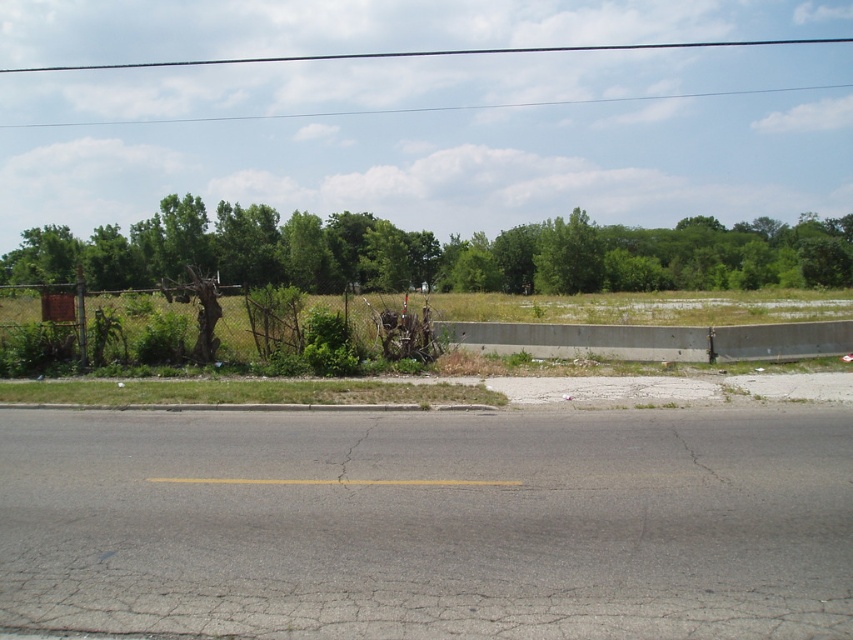
Does green leafy tree at upper center appear on the left side of rusty metal fence at left?

Correct, you'll find green leafy tree at upper center to the left of rusty metal fence at left.

Who is shorter, green leafy tree at upper center or rusty metal fence at left?

Standing shorter between the two is rusty metal fence at left.

Locate an element on the screen. The image size is (853, 640). green leafy tree at upper center is located at coordinates (x=437, y=253).

Image resolution: width=853 pixels, height=640 pixels. I want to click on green leafy tree at upper center, so pyautogui.click(x=437, y=253).